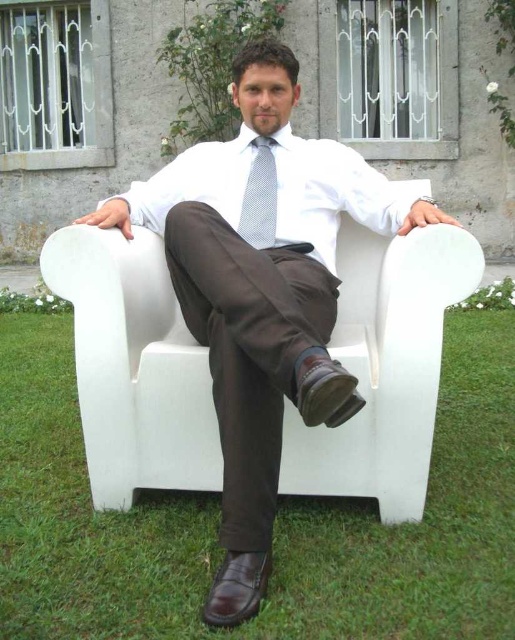
Describe the element at coordinates (330, 193) in the screenshot. The width and height of the screenshot is (515, 640). I see `white smooth dress shirt at center` at that location.

Between white smooth dress shirt at center and white dotted fabric tie at center, which one appears on the right side from the viewer's perspective?

white smooth dress shirt at center

The width and height of the screenshot is (515, 640). Describe the element at coordinates (330, 193) in the screenshot. I see `white smooth dress shirt at center` at that location.

The image size is (515, 640). I want to click on white smooth dress shirt at center, so click(330, 193).

What are the coordinates of `matte white suit at center` in the screenshot? It's located at (262, 292).

Is point (278, 266) more distant than point (306, 230)?

No, (278, 266) is in front of (306, 230).

Is point (310, 400) more distant than point (273, 136)?

No, it is not.

Find the location of a particular element. matte white suit at center is located at coordinates (262, 292).

Does matte white suit at center have a lesser width compared to white dotted fabric tie at center?

No, matte white suit at center is not thinner than white dotted fabric tie at center.

From the picture: Does matte white suit at center have a greater height compared to white dotted fabric tie at center?

Yes, matte white suit at center is taller than white dotted fabric tie at center.

Locate an element on the screen. matte white suit at center is located at coordinates (262, 292).

At what (x,y) coordinates should I click in order to perform the action: click on matte white suit at center. Please return your answer as a coordinate pair (x, y). The width and height of the screenshot is (515, 640). Looking at the image, I should click on (262, 292).